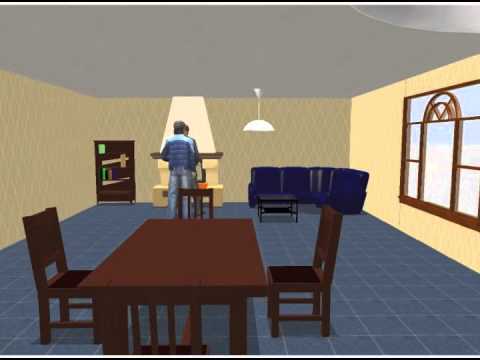
Where is `curtain`? Image resolution: width=480 pixels, height=360 pixels. curtain is located at coordinates (194, 122).